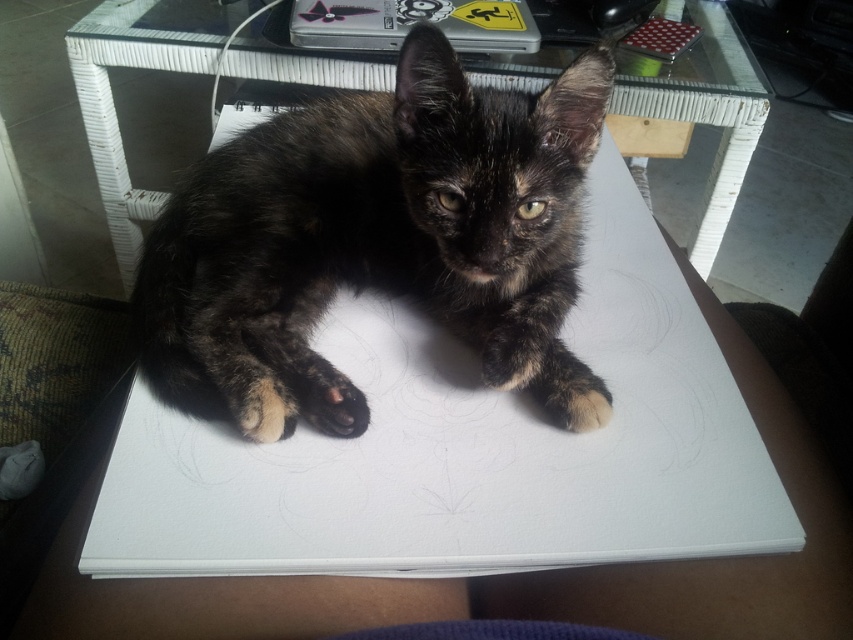
Question: Does dark tortoiseshell fur at center appear on the left side of transparent glass table at center?

Choices:
 (A) no
 (B) yes

Answer: (B)

Question: Does dark tortoiseshell fur at center come in front of transparent glass table at center?

Choices:
 (A) yes
 (B) no

Answer: (A)

Question: Which object is farther from the camera taking this photo?

Choices:
 (A) transparent glass table at center
 (B) dark tortoiseshell fur at center

Answer: (A)

Question: Is dark tortoiseshell fur at center below dark brown fur paw at center?

Choices:
 (A) no
 (B) yes

Answer: (A)

Question: Which point is farther from the camera taking this photo?

Choices:
 (A) (257, 412)
 (B) (175, 45)

Answer: (B)

Question: Among these points, which one is farthest from the camera?

Choices:
 (A) (316, 364)
 (B) (129, 35)

Answer: (B)